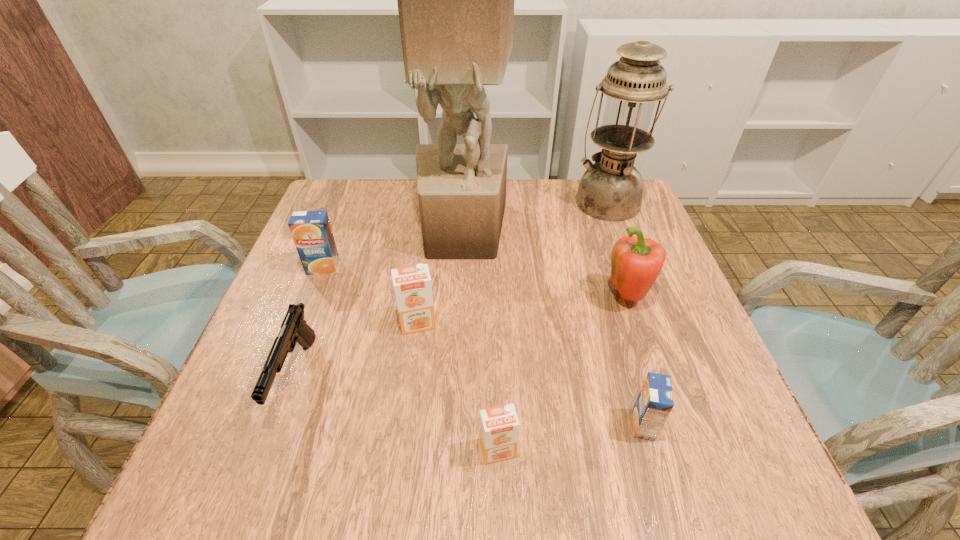
At what (x,y) coordinates should I click in order to perform the action: click on object that is at the far right corner. Please return your answer as a coordinate pair (x, y). Looking at the image, I should click on (611, 189).

This screenshot has height=540, width=960. What are the coordinates of `vacant space at the far edge of the desktop` in the screenshot? It's located at (413, 223).

The width and height of the screenshot is (960, 540). What are the coordinates of `vacant space at the near edge of the desktop` in the screenshot? It's located at (358, 472).

You are a GUI agent. You are given a task and a screenshot of the screen. Output one action in this format:
    pyautogui.click(x=<x>, y=<y>)
    Task: Click on the free spot at the left edge of the desktop
    This screenshot has height=540, width=960.
    Given the screenshot: What is the action you would take?
    pyautogui.click(x=316, y=342)

The width and height of the screenshot is (960, 540). I want to click on free space at the right edge, so click(661, 354).

Find the location of a particular element. free space at the far left corner is located at coordinates (337, 198).

Find the location of a particular element. The image size is (960, 540). free space that is in between the left blue orange_juice and the smaller blue orange_juice is located at coordinates click(484, 346).

The image size is (960, 540). What are the coordinates of `empty space that is in between the tallest object and the gun` in the screenshot? It's located at (379, 304).

Where is `empty space that is in between the farthest orange juice and the bigger orange orange juice`? empty space that is in between the farthest orange juice and the bigger orange orange juice is located at coordinates (371, 296).

What are the coordinates of `vacant area between the gray sculpture and the pepper` in the screenshot? It's located at (545, 265).